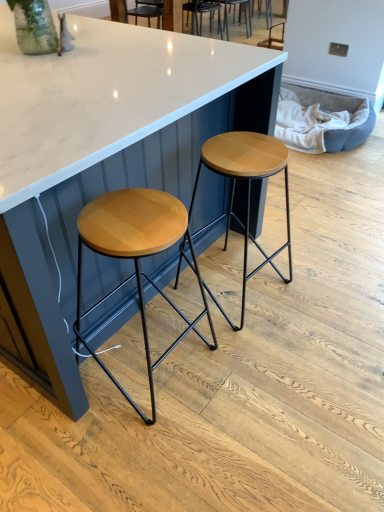
Question: Considering the relative positions of wooden seat at center, the first chair viewed from the front, and wooden matte stool at center, the first stool viewed from the right, in the image provided, is wooden seat at center, the first chair viewed from the front, to the left or to the right of wooden matte stool at center, the first stool viewed from the right,?

Choices:
 (A) left
 (B) right

Answer: (A)

Question: Considering the positions of point (195, 20) and point (261, 168), is point (195, 20) closer or farther from the camera than point (261, 168)?

Choices:
 (A) farther
 (B) closer

Answer: (A)

Question: Which object is the closest to the wooden matte stool at center, the first stool viewed from the right?

Choices:
 (A) woodenmaterial/texturestool at left, which appears as the 2th stool when viewed from the right
 (B) wooden seat at center, the 1th chair positioned from the back
 (C) wooden seat at center, positioned as the second chair in right-to-left order
 (D) white glossy table at center

Answer: (A)

Question: Estimate the real-world distances between objects in this image. Which object is farther from the wooden matte stool at center, the first stool viewed from the right?

Choices:
 (A) white glossy table at center
 (B) wooden seat at center, positioned as the second chair in right-to-left order
 (C) woodenmaterial/texturestool at left, which appears as the 2th stool when viewed from the right
 (D) wooden seat at center, the 1th chair positioned from the back

Answer: (D)